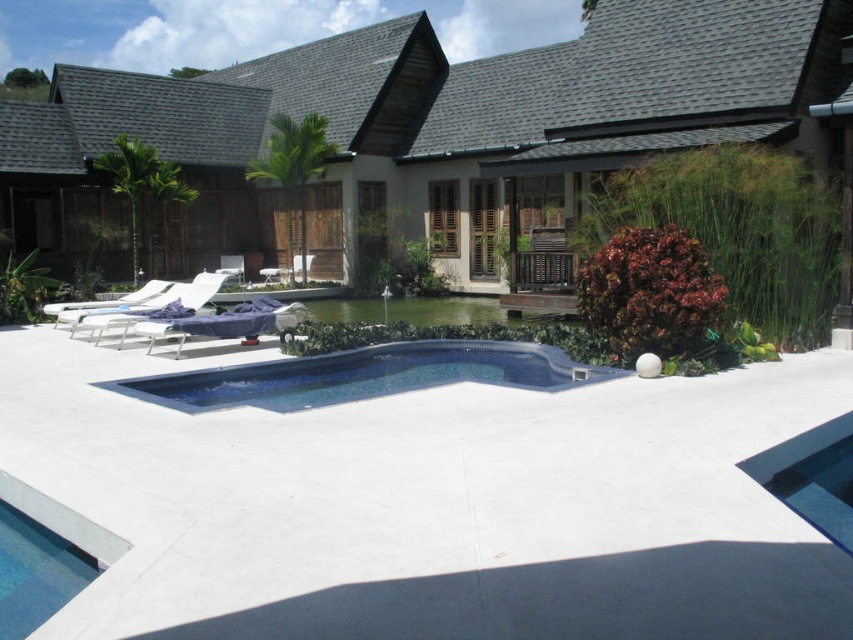
Can you confirm if smooth concrete pool at center is shorter than blue glossy swimming pool at center?

Incorrect, smooth concrete pool at center's height does not fall short of blue glossy swimming pool at center's.

Is smooth concrete pool at center bigger than blue glossy swimming pool at center?

Indeed, smooth concrete pool at center has a larger size compared to blue glossy swimming pool at center.

Image resolution: width=853 pixels, height=640 pixels. In order to click on smooth concrete pool at center in this screenshot , I will do `click(427, 134)`.